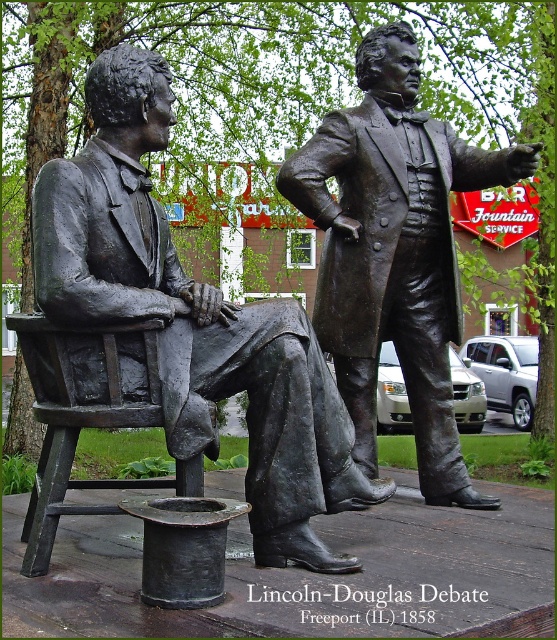
Based on the scene description, can you determine which object is positioned higher between the bronze statue of man sitting at left and the bronze wooden chair at left?

The bronze statue of man sitting at left is positioned above the bronze wooden chair at left, so the statue is higher than the chair.

What is the significance of the coordinates point (x=394, y=252) in the image?

The coordinates point (x=394, y=252) correspond to the bronze statue at center, which commemorates the Lincoln Douglas Debate in Freeport, Illinois from 1858.

What is the significance of the coordinates point [193,320] in the image?

The coordinates point [193,320] correspond to the bronze statue of man sitting at left.